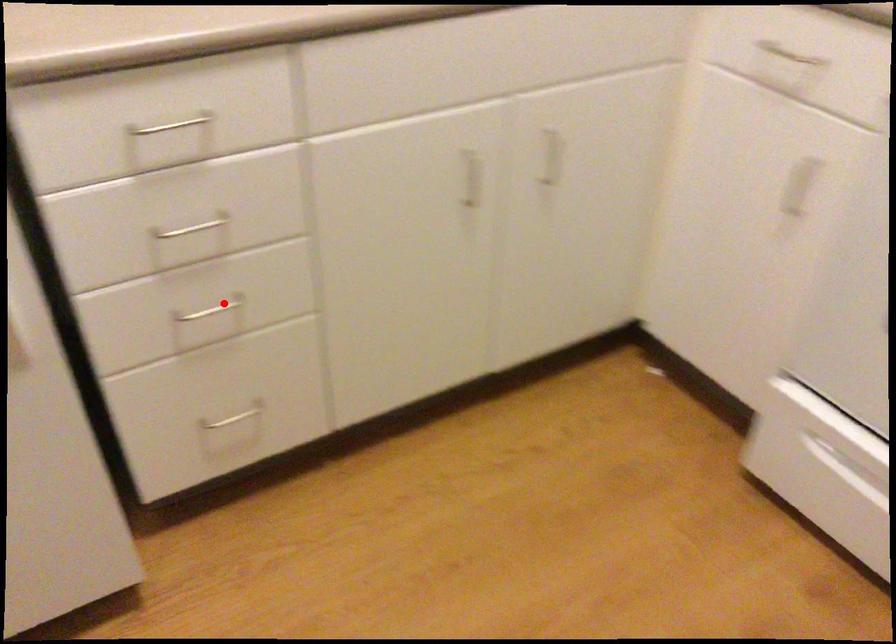
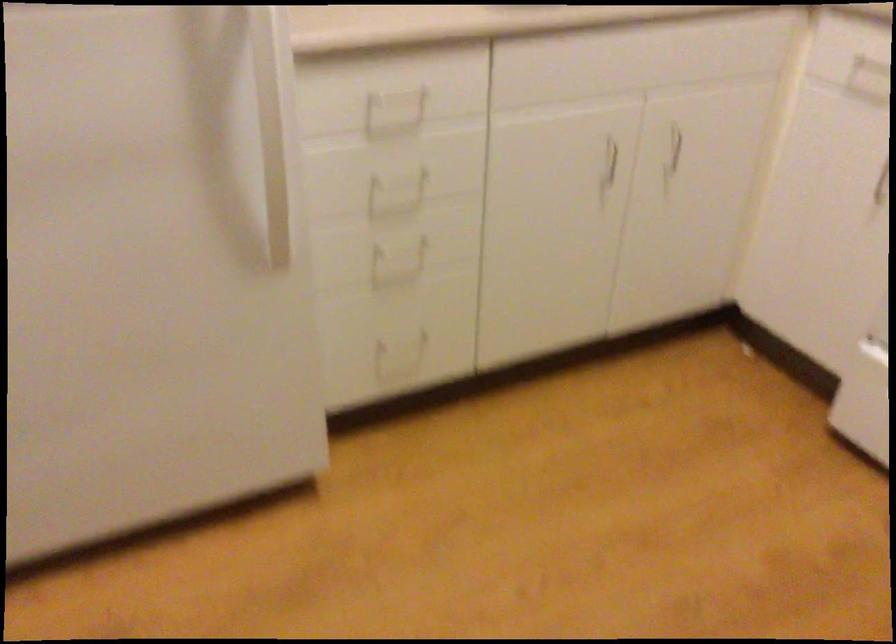
Question: I am providing you with two images of the same scene from different viewpoints. In image1, a red point is highlighted. Considering the same 3D point in image2, which of the following is correct?

Choices:
 (A) It is closer
 (B) It is farther

Answer: (B)